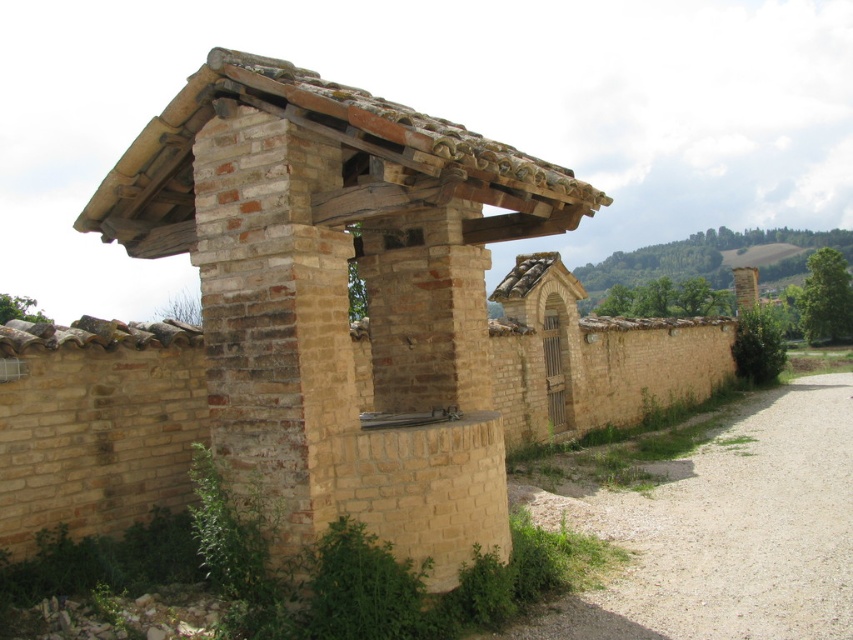
Is point (219, 212) positioned in front of point (640, 554)?

Yes, point (219, 212) is closer to viewer.

Can you confirm if brick/rough stone hut at center is positioned to the right of gravelly dirt path at lower right?

Incorrect, brick/rough stone hut at center is not on the right side of gravelly dirt path at lower right.

Where is `brick/rough stone hut at center`? The height and width of the screenshot is (640, 853). brick/rough stone hut at center is located at coordinates (340, 292).

This screenshot has width=853, height=640. In order to click on brick/rough stone hut at center in this screenshot , I will do `click(340, 292)`.